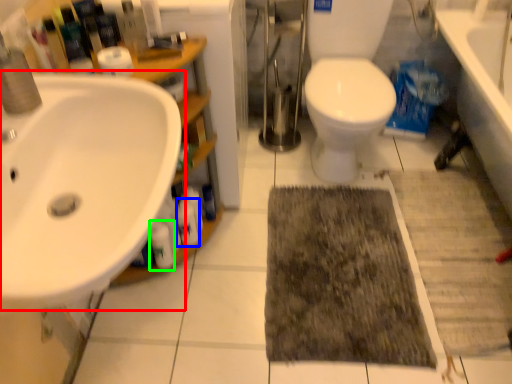
Question: Considering the real-world distances, which object is closest to sink (highlighted by a red box)? cleaning product (highlighted by a blue box) or cleaning product (highlighted by a green box).

Choices:
 (A) cleaning product
 (B) cleaning product

Answer: (B)